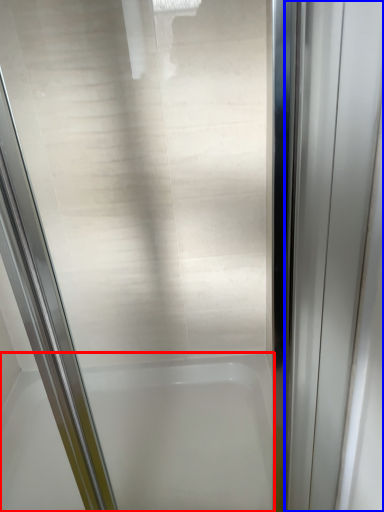
Question: Which point is further to the camera, bathtub (highlighted by a red box) or elevator door (highlighted by a blue box)?

Choices:
 (A) bathtub
 (B) elevator door

Answer: (A)